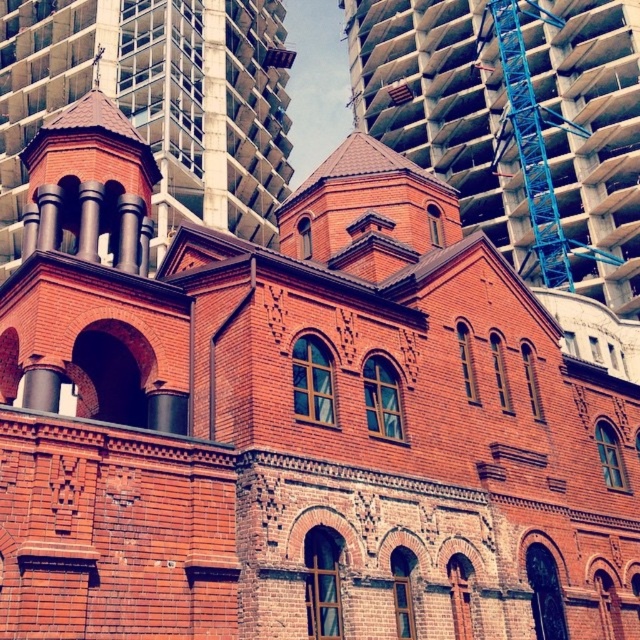
Which is more to the left, red brick tower at upper left or blue metallic crane at upper right?

red brick tower at upper left

The image size is (640, 640). Find the location of `red brick tower at upper left`. red brick tower at upper left is located at coordinates (157, 102).

Can you confirm if red brick building at center is smaller than red brick tower at upper left?

Correct, red brick building at center occupies less space than red brick tower at upper left.

Locate an element on the screen. red brick building at center is located at coordinates (440, 106).

Does red brick building at center have a lesser width compared to blue metallic crane at upper right?

In fact, red brick building at center might be wider than blue metallic crane at upper right.

Is red brick building at center wider than blue metallic crane at upper right?

Yes, red brick building at center is wider than blue metallic crane at upper right.

Does point (572, 33) lie behind point (550, 234)?

Yes.

The height and width of the screenshot is (640, 640). Identify the location of red brick building at center. (x=440, y=106).